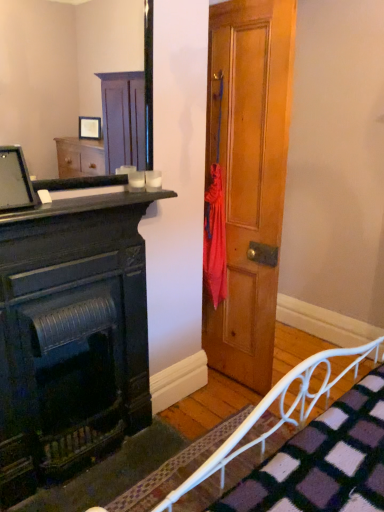
Question: Is wooden frame mirror at upper left oriented towards white metal bed frame at lower right?

Choices:
 (A) yes
 (B) no

Answer: (B)

Question: From the image's perspective, does wooden frame mirror at upper left appear higher than white metal bed frame at lower right?

Choices:
 (A) no
 (B) yes

Answer: (B)

Question: From the image's perspective, is wooden frame mirror at upper left beneath white metal bed frame at lower right?

Choices:
 (A) yes
 (B) no

Answer: (B)

Question: Is wooden frame mirror at upper left positioned behind white metal bed frame at lower right?

Choices:
 (A) yes
 (B) no

Answer: (A)

Question: Can you confirm if wooden frame mirror at upper left is taller than white metal bed frame at lower right?

Choices:
 (A) yes
 (B) no

Answer: (A)

Question: Can you confirm if wooden frame mirror at upper left is shorter than white metal bed frame at lower right?

Choices:
 (A) no
 (B) yes

Answer: (A)

Question: Is white metal bed frame at lower right inside matte black monitor at upper left?

Choices:
 (A) yes
 (B) no

Answer: (B)

Question: From the image's perspective, is matte black monitor at upper left above white metal bed frame at lower right?

Choices:
 (A) no
 (B) yes

Answer: (B)

Question: Does matte black monitor at upper left have a lesser width compared to white metal bed frame at lower right?

Choices:
 (A) yes
 (B) no

Answer: (A)

Question: Does matte black monitor at upper left lie behind white metal bed frame at lower right?

Choices:
 (A) no
 (B) yes

Answer: (B)

Question: Considering the relative sizes of matte black monitor at upper left and white metal bed frame at lower right in the image provided, is matte black monitor at upper left shorter than white metal bed frame at lower right?

Choices:
 (A) yes
 (B) no

Answer: (A)

Question: Is matte black monitor at upper left not within white metal bed frame at lower right?

Choices:
 (A) yes
 (B) no

Answer: (A)

Question: Is matte black fireplace at left wider than wooden frame mirror at upper left?

Choices:
 (A) yes
 (B) no

Answer: (A)